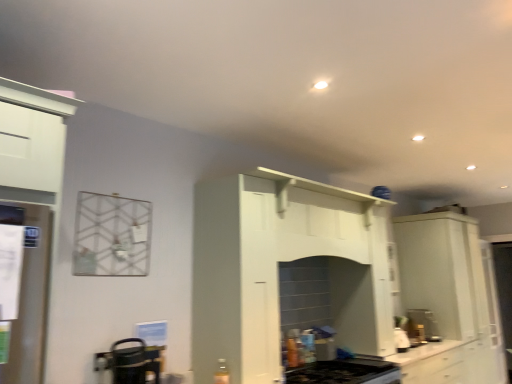
You are a GUI agent. You are given a task and a screenshot of the screen. Output one action in this format:
    pyautogui.click(x=<x>, y=<y>)
    Task: Click on the white glossy cabinet at right
    The image size is (512, 384).
    Given the screenshot: What is the action you would take?
    pyautogui.click(x=450, y=300)

What do you see at coordinates (31, 305) in the screenshot? The image size is (512, 384). I see `white glossy refrigerator at left, arranged as the second appliance when viewed from the right` at bounding box center [31, 305].

Find the location of a particular element. white glossy countertop at lower center is located at coordinates (428, 362).

Identify the location of black plastic coffee machine at lower right. Image resolution: width=512 pixels, height=384 pixels. (422, 325).

Locate an element on the screen. white glossy cabinet at right is located at coordinates (450, 300).

Is point (155, 348) closer or farther from the camera than point (20, 349)?

Clearly, point (155, 348) is more distant from the camera than point (20, 349).

Is metallic silver kettle at lower left, which appears as the second appliance when viewed from the left, wider than white glossy refrigerator at left, arranged as the second appliance when viewed from the right?

Correct, the width of metallic silver kettle at lower left, which appears as the second appliance when viewed from the left, exceeds that of white glossy refrigerator at left, arranged as the second appliance when viewed from the right.

Is metallic silver kettle at lower left, positioned as the 1th appliance in right-to-left order, looking in the opposite direction of white glossy refrigerator at left, acting as the 1th appliance starting from the front?

No, metallic silver kettle at lower left, positioned as the 1th appliance in right-to-left order, is not facing the opposite direction of white glossy refrigerator at left, acting as the 1th appliance starting from the front.

Which object is further away from the camera, metallic silver kettle at lower left, marked as the 1th appliance in a bottom-to-top arrangement, or white glossy refrigerator at left, which appears as the second appliance when viewed from the back?

metallic silver kettle at lower left, marked as the 1th appliance in a bottom-to-top arrangement.

Considering the points (41, 211) and (430, 329), which point is in front, point (41, 211) or point (430, 329)?

Positioned in front is point (41, 211).

Is white glossy refrigerator at left, positioned as the second appliance in bottom-to-top order, positioned far away from black plastic coffee machine at lower right?

Yes.

Can you tell me how much white glossy refrigerator at left, the first appliance when ordered from left to right, and black plastic coffee machine at lower right differ in facing direction?

white glossy refrigerator at left, the first appliance when ordered from left to right, and black plastic coffee machine at lower right are facing 2.37 degrees away from each other.

Which of these two, white glossy refrigerator at left, which appears as the second appliance when viewed from the back, or black plastic coffee machine at lower right, stands shorter?

With less height is black plastic coffee machine at lower right.

From the image's perspective, is black plastic coffee machine at lower right beneath black glass gas stove at lower center?

Indeed, from the image's perspective, black plastic coffee machine at lower right is shown beneath black glass gas stove at lower center.

Is the depth of black plastic coffee machine at lower right greater than that of black glass gas stove at lower center?

Yes, black plastic coffee machine at lower right is further from the camera.

Considering the positions of points (436, 335) and (366, 365), is point (436, 335) farther from camera compared to point (366, 365)?

That is True.

Is black plastic coffee machine at lower right to the left or to the right of black glass gas stove at lower center in the image?

black plastic coffee machine at lower right is positioned on black glass gas stove at lower center's right side.

Which object is positioned more to the right, white glossy cabinet at right or black plastic coffee machine at lower right?

Positioned to the right is white glossy cabinet at right.

Find the location of a particular element. The width and height of the screenshot is (512, 384). cabinetry on the right of black plastic coffee machine at lower right is located at coordinates (450, 300).

Is white glossy cabinet at right outside of black plastic coffee machine at lower right?

Yes, white glossy cabinet at right is located beyond the bounds of black plastic coffee machine at lower right.

From a real-world perspective, is white glossy cabinet at right positioned over black plastic coffee machine at lower right based on gravity?

Yes, from a real-world perspective, white glossy cabinet at right is over black plastic coffee machine at lower right

Who is smaller, metallic silver kettle at lower left, positioned as the 1th appliance in right-to-left order, or white glossy countertop at lower center?

metallic silver kettle at lower left, positioned as the 1th appliance in right-to-left order.

From the image's perspective, which one is positioned higher, metallic silver kettle at lower left, arranged as the second appliance when viewed from the top, or white glossy countertop at lower center?

metallic silver kettle at lower left, arranged as the second appliance when viewed from the top, from the image's perspective.

Does point (104, 363) lie in front of point (403, 365)?

That is True.

How many degrees apart are the facing directions of black plastic coffee machine at lower right and white glossy refrigerator at left, acting as the 1th appliance starting from the front?

They differ by 2.37 degrees in their facing directions.

Can you confirm if black plastic coffee machine at lower right is positioned to the right of white glossy refrigerator at left, which appears as the second appliance when viewed from the back?

Yes, black plastic coffee machine at lower right is to the right of white glossy refrigerator at left, which appears as the second appliance when viewed from the back.

Which is nearer, (423, 320) or (15, 353)?

The point (15, 353) is closer to the camera.

From the picture: From a real-world perspective, who is located higher, black plastic coffee machine at lower right or white glossy refrigerator at left, acting as the 1th appliance starting from the front?

white glossy refrigerator at left, acting as the 1th appliance starting from the front, is physically above.

Is metallic silver kettle at lower left, marked as the 1th appliance in a bottom-to-top arrangement, further to camera compared to white glossy cabinet at right?

No, metallic silver kettle at lower left, marked as the 1th appliance in a bottom-to-top arrangement, is closer to the camera.

Which object is wider, metallic silver kettle at lower left, which is counted as the second appliance, starting from the front, or white glossy cabinet at right?

white glossy cabinet at right is wider.

Consider the image. How far apart are metallic silver kettle at lower left, the 1th appliance viewed from the back, and white glossy cabinet at right?

They are 2.85 meters apart.

Is white glossy cabinet at right located within metallic silver kettle at lower left, which appears as the second appliance when viewed from the left?

No.

In the image, there is a white glossy refrigerator at left, positioned as the second appliance in bottom-to-top order. Find the location of `appliance below it (from the image's perspective)`. appliance below it (from the image's perspective) is located at coordinates [x=130, y=362].

Where is `the 2nd appliance in front of the black plastic coffee machine at lower right, counting from the anchor's position`? the 2nd appliance in front of the black plastic coffee machine at lower right, counting from the anchor's position is located at coordinates (31, 305).

Which object lies further to the anchor point white glossy countertop at lower center, white glossy cabinet at right or black plastic coffee machine at lower right?

white glossy cabinet at right is positioned further to the anchor white glossy countertop at lower center.

When comparing their distances from white glossy countertop at lower center, does black glass gas stove at lower center or black plastic coffee machine at lower right seem further?

black glass gas stove at lower center lies further to white glossy countertop at lower center than the other object.

Considering their positions, is black glass gas stove at lower center positioned closer to white glossy countertop at lower center than white glossy cabinet at right?

white glossy cabinet at right is closer to white glossy countertop at lower center.

Based on the photo, which object lies nearer to the anchor point metallic silver kettle at lower left, arranged as the second appliance when viewed from the top, white glossy countertop at lower center or black plastic coffee machine at lower right?

Based on the image, white glossy countertop at lower center appears to be nearer to metallic silver kettle at lower left, arranged as the second appliance when viewed from the top.

Considering their positions, is metallic silver kettle at lower left, positioned as the 1th appliance in right-to-left order, positioned closer to black glass gas stove at lower center than white glossy refrigerator at left, acting as the 1th appliance starting from the front?

Based on the image, metallic silver kettle at lower left, positioned as the 1th appliance in right-to-left order, appears to be nearer to black glass gas stove at lower center.

Considering their positions, is white glossy cabinet at right positioned closer to white glossy countertop at lower center than black glass gas stove at lower center?

white glossy cabinet at right lies closer to white glossy countertop at lower center than the other object.

Based on their spatial positions, is black glass gas stove at lower center or white glossy cabinet at right closer to white glossy refrigerator at left, positioned as the second appliance in bottom-to-top order?

The object closer to white glossy refrigerator at left, positioned as the second appliance in bottom-to-top order, is black glass gas stove at lower center.

Estimate the real-world distances between objects in this image. Which object is closer to white glossy refrigerator at left, positioned as the second appliance in bottom-to-top order, metallic silver kettle at lower left, which is counted as the second appliance, starting from the front, or white glossy cabinet at right?

Based on the image, metallic silver kettle at lower left, which is counted as the second appliance, starting from the front, appears to be nearer to white glossy refrigerator at left, positioned as the second appliance in bottom-to-top order.

Find the location of a particular element. cabinetry located between white glossy refrigerator at left, positioned as the second appliance in bottom-to-top order, and black plastic coffee machine at lower right in the depth direction is located at coordinates (450, 300).

Where is `countertop located between black glass gas stove at lower center and white glossy cabinet at right in the depth direction`? The image size is (512, 384). countertop located between black glass gas stove at lower center and white glossy cabinet at right in the depth direction is located at coordinates (428, 362).

At what (x,y) coordinates should I click in order to perform the action: click on cabinetry positioned between black glass gas stove at lower center and black plastic coffee machine at lower right from near to far. Please return your answer as a coordinate pair (x, y). Image resolution: width=512 pixels, height=384 pixels. Looking at the image, I should click on (450, 300).

Identify the location of appliance between white glossy refrigerator at left, arranged as the second appliance when viewed from the right, and white glossy cabinet at right from left to right. Image resolution: width=512 pixels, height=384 pixels. (130, 362).